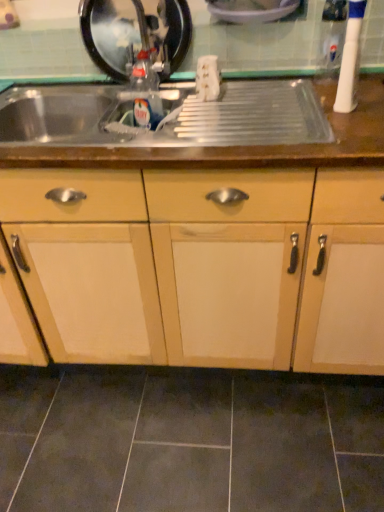
Question: Is metallic black sink at upper left, marked as the 3th appliance in a right-to-left arrangement, wider than metallic stainless steel sink at upper center?

Choices:
 (A) yes
 (B) no

Answer: (B)

Question: Is metallic stainless steel sink at upper center completely or partially inside metallic black sink at upper left, marked as the 3th appliance in a right-to-left arrangement?

Choices:
 (A) yes
 (B) no

Answer: (B)

Question: Is metallic black sink at upper left, placed as the 1th appliance when sorted from left to right, behind metallic stainless steel sink at upper center?

Choices:
 (A) no
 (B) yes

Answer: (B)

Question: From a real-world perspective, is metallic black sink at upper left, placed as the 1th appliance when sorted from left to right, positioned under metallic stainless steel sink at upper center based on gravity?

Choices:
 (A) no
 (B) yes

Answer: (A)

Question: From the image's perspective, is metallic black sink at upper left, placed as the 1th appliance when sorted from left to right, on top of metallic stainless steel sink at upper center?

Choices:
 (A) no
 (B) yes

Answer: (B)

Question: Is metallic black sink at upper left, marked as the 3th appliance in a right-to-left arrangement, taller or shorter than white plastic toothbrush at upper right, the 1th appliance viewed from the right?

Choices:
 (A) tall
 (B) short

Answer: (B)

Question: In the image, is metallic black sink at upper left, placed as the 1th appliance when sorted from left to right, on the left side or the right side of white plastic toothbrush at upper right, the 1th appliance viewed from the right?

Choices:
 (A) right
 (B) left

Answer: (B)

Question: Based on their sizes in the image, would you say metallic black sink at upper left, marked as the 3th appliance in a right-to-left arrangement, is bigger or smaller than white plastic toothbrush at upper right, the 1th appliance viewed from the right?

Choices:
 (A) big
 (B) small

Answer: (A)

Question: Does point (100, 29) appear closer or farther from the camera than point (357, 56)?

Choices:
 (A) closer
 (B) farther

Answer: (B)

Question: Looking at the image, does metallic black sink at upper left, marked as the 3th appliance in a right-to-left arrangement, seem bigger or smaller compared to wooden cabinet at center?

Choices:
 (A) small
 (B) big

Answer: (A)

Question: From a real-world perspective, relative to wooden cabinet at center, is metallic black sink at upper left, marked as the 3th appliance in a right-to-left arrangement, vertically above or below?

Choices:
 (A) above
 (B) below

Answer: (A)

Question: From the image's perspective, relative to wooden cabinet at center, is metallic black sink at upper left, placed as the 1th appliance when sorted from left to right, above or below?

Choices:
 (A) above
 (B) below

Answer: (A)

Question: Relative to wooden cabinet at center, is metallic black sink at upper left, placed as the 1th appliance when sorted from left to right, in front or behind?

Choices:
 (A) front
 (B) behind

Answer: (B)

Question: From a real-world perspective, is dark gray ceramic tile at lower center above or below wooden cabinet at center?

Choices:
 (A) below
 (B) above

Answer: (A)

Question: Is point (340, 437) closer or farther from the camera than point (225, 236)?

Choices:
 (A) farther
 (B) closer

Answer: (A)